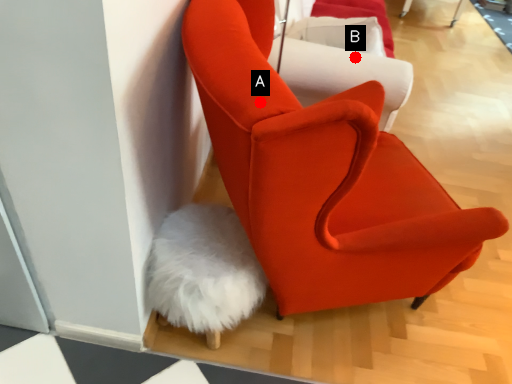
Question: Two points are circled on the image, labeled by A and B beside each circle. Which point is farther from the camera taking this photo?

Choices:
 (A) A is further
 (B) B is further

Answer: (B)